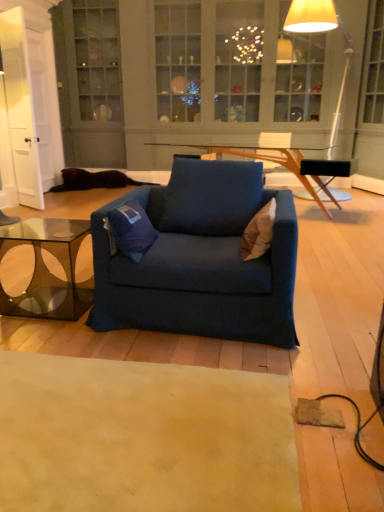
What do you see at coordinates (143, 437) in the screenshot? This screenshot has height=512, width=384. I see `beige carpet at lower center` at bounding box center [143, 437].

This screenshot has width=384, height=512. Describe the element at coordinates (20, 109) in the screenshot. I see `white glossy door at left` at that location.

Measure the distance between point (70, 257) and camera.

Point (70, 257) is 2.86 meters from camera.

What do you see at coordinates (131, 230) in the screenshot? This screenshot has height=512, width=384. I see `blue fabric pillow at center, the 2th pillow when ordered from right to left` at bounding box center [131, 230].

Image resolution: width=384 pixels, height=512 pixels. Find the location of `blue fabric pillow at center, the 2th pillow when ordered from right to left`. blue fabric pillow at center, the 2th pillow when ordered from right to left is located at coordinates (131, 230).

What do you see at coordinates (258, 233) in the screenshot? I see `beige fabric pillow at center, the 2th pillow viewed from the left` at bounding box center [258, 233].

Where is `beige carpet at lower center`? The height and width of the screenshot is (512, 384). beige carpet at lower center is located at coordinates (143, 437).

Are blue fabric armchair at center and beige carpet at lower center beside each other?

They are not placed beside each other.

From the image's perspective, is blue fabric armchair at center located above beige carpet at lower center?

Yes, from the image's perspective, blue fabric armchair at center is above beige carpet at lower center.

Between blue fabric armchair at center and beige carpet at lower center, which one appears on the left side from the viewer's perspective?

Positioned to the left is beige carpet at lower center.

Is blue fabric armchair at center surrounding beige carpet at lower center?

No, beige carpet at lower center is not surrounded by blue fabric armchair at center.

From the picture: Considering the sizes of objects blue fabric pillow at center, the first pillow from the left, and transparent glass coffee table at lower left in the image provided, who is shorter, blue fabric pillow at center, the first pillow from the left, or transparent glass coffee table at lower left?

blue fabric pillow at center, the first pillow from the left.

Locate an element on the screen. This screenshot has width=384, height=512. the 1st pillow to the right of the transparent glass coffee table at lower left, starting your count from the anchor is located at coordinates (131, 230).

Between blue fabric pillow at center, the first pillow from the left, and transparent glass coffee table at lower left, which one appears on the left side from the viewer's perspective?

transparent glass coffee table at lower left is more to the left.

Is blue fabric pillow at center, the first pillow from the left, aimed at transparent glass coffee table at lower left?

No, blue fabric pillow at center, the first pillow from the left, is not facing towards transparent glass coffee table at lower left.

From the image's perspective, is blue fabric chair at center on white glossy door at left?

No, from the image's perspective, blue fabric chair at center is not above white glossy door at left.

In the scene shown: Which of these two, blue fabric chair at center or white glossy door at left, is bigger?

blue fabric chair at center is bigger.

Considering the relative positions of blue fabric chair at center and white glossy door at left in the image provided, is blue fabric chair at center in front of white glossy door at left?

Yes, blue fabric chair at center is closer to the camera.

Considering the positions of objects matte white floor lamp at upper right and transparent glass coffee table at lower left in the image provided, who is more to the left, matte white floor lamp at upper right or transparent glass coffee table at lower left?

Positioned to the left is transparent glass coffee table at lower left.

Is matte white floor lamp at upper right situated inside transparent glass coffee table at lower left or outside?

matte white floor lamp at upper right is located beyond the bounds of transparent glass coffee table at lower left.

How much distance is there between matte white floor lamp at upper right and transparent glass coffee table at lower left?

matte white floor lamp at upper right and transparent glass coffee table at lower left are 4.81 meters apart from each other.

Can you confirm if matte white floor lamp at upper right is thinner than transparent glass coffee table at lower left?

In fact, matte white floor lamp at upper right might be wider than transparent glass coffee table at lower left.

Would you say blue fabric pillow at center, the 2th pillow when ordered from right to left, is inside or outside beige fabric pillow at center, the 2th pillow viewed from the left?

blue fabric pillow at center, the 2th pillow when ordered from right to left, is not inside beige fabric pillow at center, the 2th pillow viewed from the left, it's outside.

Visually, is blue fabric pillow at center, the 2th pillow when ordered from right to left, positioned to the left or to the right of beige fabric pillow at center, the 2th pillow viewed from the left?

blue fabric pillow at center, the 2th pillow when ordered from right to left, is positioned on beige fabric pillow at center, the 2th pillow viewed from the left,'s left side.

From a real-world perspective, between white glossy door at left and beige carpet at lower center, who is vertically higher?

white glossy door at left.

Can you confirm if white glossy door at left is positioned to the left of beige carpet at lower center?

Yes.

Is white glossy door at left oriented away from beige carpet at lower center?

No, beige carpet at lower center is not at the back of white glossy door at left.

How distant is white glossy door at left from beige carpet at lower center?

white glossy door at left is 13.08 feet from beige carpet at lower center.

Between white glossy door at left and transparent glass coffee table at lower left, which one appears on the left side from the viewer's perspective?

white glossy door at left is more to the left.

From a real-world perspective, is white glossy door at left under transparent glass coffee table at lower left?

Incorrect, from a real-world perspective, white glossy door at left is higher than transparent glass coffee table at lower left.

How many degrees apart are the facing directions of white glossy door at left and transparent glass coffee table at lower left?

The facing directions of white glossy door at left and transparent glass coffee table at lower left are 148 degrees apart.

Identify the location of armchair that is on the right side of beige carpet at lower center. The height and width of the screenshot is (512, 384). (273, 143).

This screenshot has height=512, width=384. Identify the location of coffee table below the blue fabric pillow at center, the 2th pillow when ordered from right to left (from the image's perspective). (48, 269).

In the scene shown: Based on their spatial positions, is blue fabric armchair at center or white glossy door at left closer to beige carpet at lower center?

white glossy door at left lies closer to beige carpet at lower center than the other object.

Which object lies further to the anchor point blue fabric chair at center, transparent glass coffee table at lower left or beige fabric pillow at center, marked as the 1th pillow in a right-to-left arrangement?

transparent glass coffee table at lower left is positioned further to the anchor blue fabric chair at center.

From the image, which object appears to be nearer to blue fabric chair at center, blue fabric armchair at center or beige fabric pillow at center, marked as the 1th pillow in a right-to-left arrangement?

Among the two, beige fabric pillow at center, marked as the 1th pillow in a right-to-left arrangement, is located nearer to blue fabric chair at center.

Based on their spatial positions, is blue fabric pillow at center, the first pillow from the left, or beige carpet at lower center closer to blue fabric chair at center?

blue fabric pillow at center, the first pillow from the left, lies closer to blue fabric chair at center than the other object.

From the image, which object appears to be farther from matte white floor lamp at upper right, beige fabric pillow at center, the 2th pillow viewed from the left, or blue fabric chair at center?

Based on the image, beige fabric pillow at center, the 2th pillow viewed from the left, appears to be further to matte white floor lamp at upper right.

When comparing their distances from transparent glass coffee table at lower left, does blue fabric chair at center or beige fabric pillow at center, marked as the 1th pillow in a right-to-left arrangement, seem closer?

Among the two, beige fabric pillow at center, marked as the 1th pillow in a right-to-left arrangement, is located nearer to transparent glass coffee table at lower left.

Estimate the real-world distances between objects in this image. Which object is closer to blue fabric chair at center, transparent glass coffee table at lower left or white glossy door at left?

white glossy door at left.

Based on the photo, based on their spatial positions, is transparent glass coffee table at lower left or beige fabric pillow at center, marked as the 1th pillow in a right-to-left arrangement, closer to blue fabric pillow at center, the 2th pillow when ordered from right to left?

The object closer to blue fabric pillow at center, the 2th pillow when ordered from right to left, is beige fabric pillow at center, marked as the 1th pillow in a right-to-left arrangement.

This screenshot has width=384, height=512. I want to click on chair between transparent glass coffee table at lower left and beige fabric pillow at center, marked as the 1th pillow in a right-to-left arrangement, so click(202, 260).

Image resolution: width=384 pixels, height=512 pixels. What are the coordinates of `pillow between beige fabric pillow at center, marked as the 1th pillow in a right-to-left arrangement, and blue fabric chair at center, along the z-axis` in the screenshot? It's located at (131, 230).

In order to click on chair between white glossy door at left and blue fabric chair at center from left to right in this screenshot , I will do `click(202, 260)`.

The width and height of the screenshot is (384, 512). I want to click on coffee table between blue fabric chair at center and blue fabric armchair at center in the front-back direction, so click(x=48, y=269).